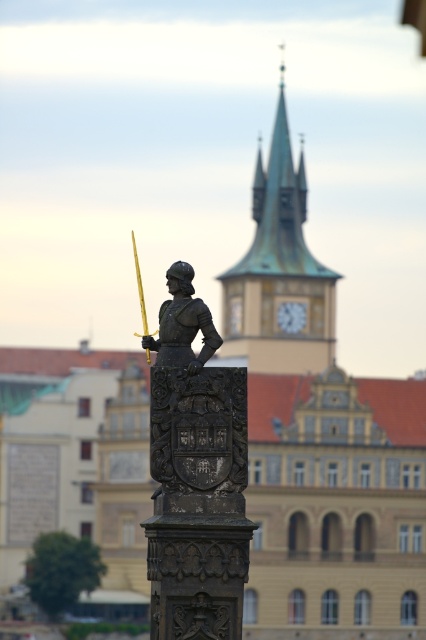
Based on the photo, you are a tourist standing in front of the historic building. You see the metallic clock face at center and the gold metallic sword at center. Which object is closer to you?

The metallic clock face at center is closer to you because the gold metallic sword at center is behind it.

You are a tourist standing in front of the statue and want to take a photo of both the polished bronze statue at center and the gold metallic sword at center. Since you have a camera with a limited zoom, which object should you focus on first to ensure both are in the frame?

You should focus on the polished bronze statue at center first because it is closer to you than the gold metallic sword at center. By focusing on the closer object, both will be in the frame as the sword is further back.